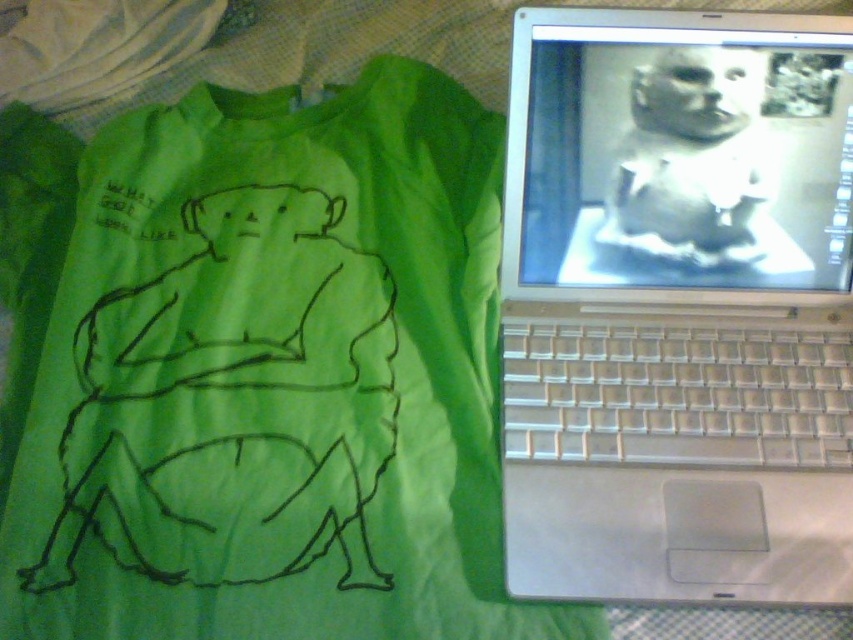
Question: In this image, where is green fabric t-shirt at upper left located relative to white matte baby at upper right?

Choices:
 (A) left
 (B) right

Answer: (A)

Question: Among these points, which one is nearest to the camera?

Choices:
 (A) pos(612,216)
 (B) pos(94,403)

Answer: (B)

Question: Among these objects, which one is farthest from the camera?

Choices:
 (A) white matte baby at upper right
 (B) silver metallic laptop at upper right

Answer: (A)

Question: Which point appears closest to the camera in this image?

Choices:
 (A) (830, 323)
 (B) (635, 92)

Answer: (B)

Question: Is green fabric t-shirt at upper left above silver metallic laptop at upper right?

Choices:
 (A) yes
 (B) no

Answer: (B)

Question: Can you confirm if green fabric t-shirt at upper left is smaller than silver metallic laptop at upper right?

Choices:
 (A) no
 (B) yes

Answer: (A)